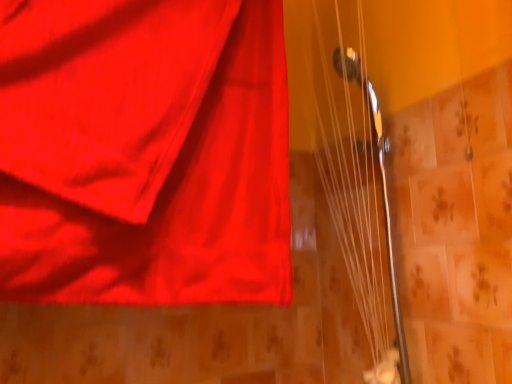
Where is `metallic silver strings at upper right`? The image size is (512, 384). metallic silver strings at upper right is located at coordinates (356, 202).

The width and height of the screenshot is (512, 384). Describe the element at coordinates (356, 202) in the screenshot. I see `metallic silver strings at upper right` at that location.

This screenshot has height=384, width=512. Describe the element at coordinates (144, 152) in the screenshot. I see `matte red curtain at upper left` at that location.

Find the location of a particular element. matte red curtain at upper left is located at coordinates (144, 152).

The image size is (512, 384). Find the location of `metallic silver strings at upper right`. metallic silver strings at upper right is located at coordinates (356, 202).

Which is more to the right, metallic silver strings at upper right or matte red curtain at upper left?

From the viewer's perspective, metallic silver strings at upper right appears more on the right side.

Is metallic silver strings at upper right further to the viewer compared to matte red curtain at upper left?

Yes, metallic silver strings at upper right is behind matte red curtain at upper left.

Does point (335, 186) come behind point (211, 28)?

Yes, it is.

From the image's perspective, between metallic silver strings at upper right and matte red curtain at upper left, which one is located above?

matte red curtain at upper left is shown above in the image.

From a real-world perspective, does metallic silver strings at upper right sit lower than matte red curtain at upper left?

Yes, from a real-world perspective, metallic silver strings at upper right is below matte red curtain at upper left.

In terms of width, does metallic silver strings at upper right look wider or thinner when compared to matte red curtain at upper left?

metallic silver strings at upper right is thinner than matte red curtain at upper left.

Looking at this image, between metallic silver strings at upper right and matte red curtain at upper left, which one has less height?

With less height is matte red curtain at upper left.

Considering the relative sizes of metallic silver strings at upper right and matte red curtain at upper left in the image provided, is metallic silver strings at upper right smaller than matte red curtain at upper left?

Yes.

Choose the correct answer: Is metallic silver strings at upper right inside matte red curtain at upper left or outside it?

The correct answer is: outside.

From the picture: Is metallic silver strings at upper right far away from matte red curtain at upper left?

metallic silver strings at upper right is near matte red curtain at upper left, not far away.

Could you tell me if metallic silver strings at upper right is turned towards matte red curtain at upper left?

Yes, metallic silver strings at upper right is oriented towards matte red curtain at upper left.

How many degrees apart are the facing directions of metallic silver strings at upper right and matte red curtain at upper left?

There is a 92.9-degree angle between the facing directions of metallic silver strings at upper right and matte red curtain at upper left.

Identify the location of string below the matte red curtain at upper left (from the image's perspective). (356, 202).

In the image, is matte red curtain at upper left on the left side or the right side of metallic silver strings at upper right?

matte red curtain at upper left is positioned on metallic silver strings at upper right's left side.

Is matte red curtain at upper left in front of or behind metallic silver strings at upper right in the image?

In the image, matte red curtain at upper left appears in front of metallic silver strings at upper right.

Does point (162, 262) come closer to viewer compared to point (331, 204)?

Yes, it is in front of point (331, 204).

From the image's perspective, between matte red curtain at upper left and metallic silver strings at upper right, who is located below?

From the image's view, metallic silver strings at upper right is below.

From a real-world perspective, is matte red curtain at upper left below metallic silver strings at upper right?

No, from a real-world perspective, matte red curtain at upper left is not beneath metallic silver strings at upper right.

Considering the sizes of objects matte red curtain at upper left and metallic silver strings at upper right in the image provided, who is thinner, matte red curtain at upper left or metallic silver strings at upper right?

metallic silver strings at upper right is thinner.

Which of these two, matte red curtain at upper left or metallic silver strings at upper right, stands taller?

metallic silver strings at upper right is taller.

Between matte red curtain at upper left and metallic silver strings at upper right, which one has smaller size?

metallic silver strings at upper right.

Can metallic silver strings at upper right be found inside matte red curtain at upper left?

No.

Are matte red curtain at upper left and metallic silver strings at upper right making contact?

No, matte red curtain at upper left is not next to metallic silver strings at upper right.

Is metallic silver strings at upper right at the back of matte red curtain at upper left?

No, matte red curtain at upper left is not facing the opposite direction of metallic silver strings at upper right.

How different are the orientations of matte red curtain at upper left and metallic silver strings at upper right in degrees?

The angle between the facing direction of matte red curtain at upper left and the facing direction of metallic silver strings at upper right is 92.9 degrees.

The height and width of the screenshot is (384, 512). I want to click on string located on the right of matte red curtain at upper left, so click(356, 202).

Locate an element on the screen. This screenshot has height=384, width=512. string on the right of matte red curtain at upper left is located at coordinates (356, 202).

Where is `curtain above the metallic silver strings at upper right (from the image's perspective)`? The image size is (512, 384). curtain above the metallic silver strings at upper right (from the image's perspective) is located at coordinates (144, 152).